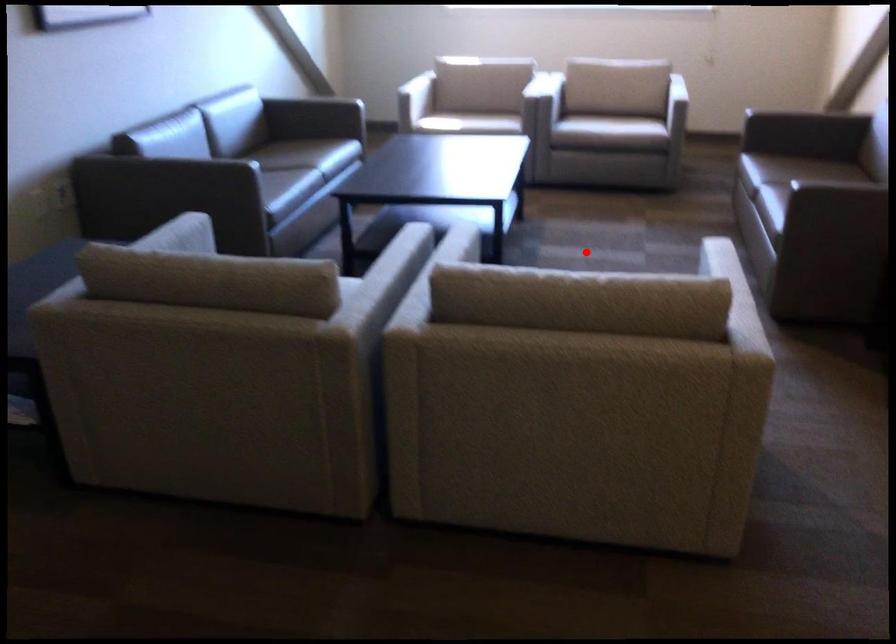
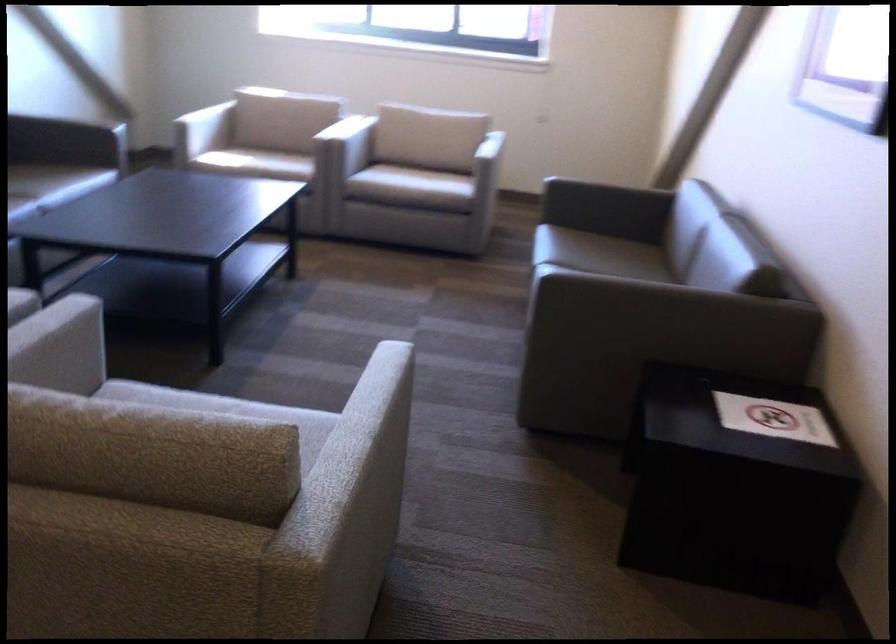
Question: I am providing you with two images of the same scene from different viewpoints. Given a red point in image1, look at the same physical point in image2. Is it:

Choices:
 (A) Closer to the viewpoint
 (B) Farther from the viewpoint

Answer: (A)